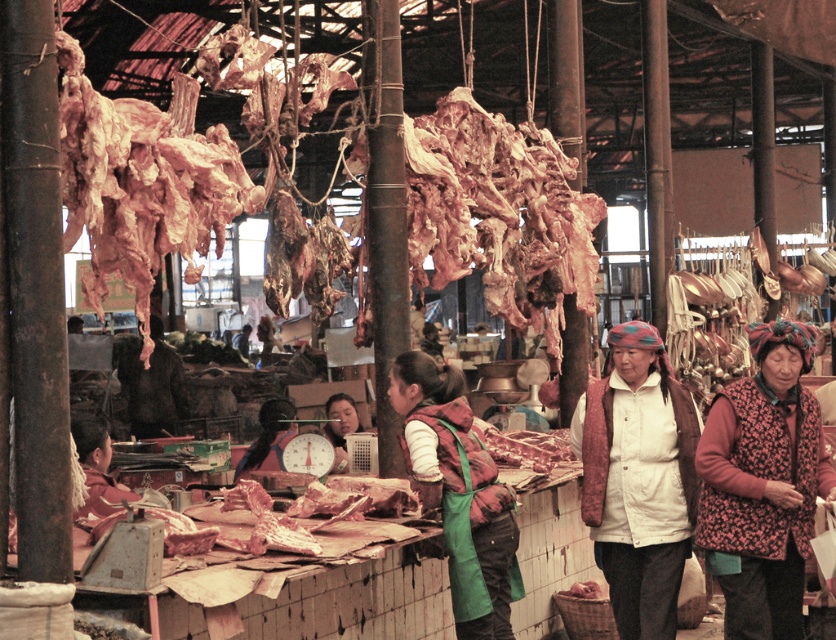
Question: Estimate the real-world distances between objects in this image. Which object is closer to the matte pink apron at center?

Choices:
 (A) floral-patterned vest at lower right
 (B) green apron at center

Answer: (B)

Question: Does floral-patterned vest at lower right have a smaller size compared to green apron at center?

Choices:
 (A) yes
 (B) no

Answer: (B)

Question: Is green apron at center to the left of matte pink apron at center from the viewer's perspective?

Choices:
 (A) yes
 (B) no

Answer: (B)

Question: Observing the image, what is the correct spatial positioning of floral-patterned vest at lower right in reference to matte pink apron at center?

Choices:
 (A) left
 (B) right

Answer: (B)

Question: Which point appears closest to the camera in this image?

Choices:
 (A) (765, 467)
 (B) (344, 406)

Answer: (A)

Question: Which of these objects is positioned closest to the floral-patterned vest at lower right?

Choices:
 (A) green apron at center
 (B) matte pink apron at center

Answer: (A)